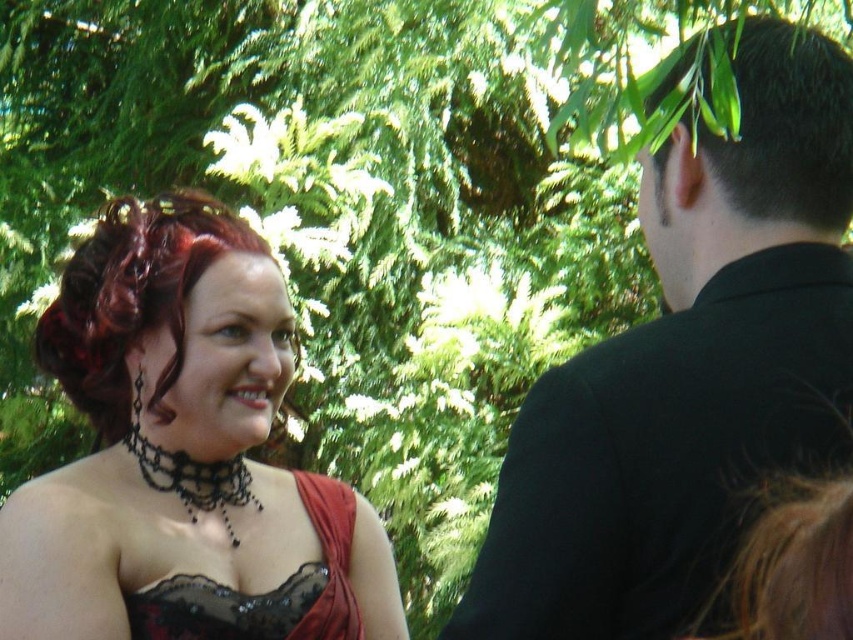
You are a photographer trying to capture a portrait of the two people in the scene. You want to ensure that both the black matte suit at upper right and the dark brown hair at upper right are clearly visible in the frame. Based on their positions, which one should you focus on first to ensure proper alignment?

The black matte suit at upper right is to the left of dark brown hair at upper right. Therefore, you should focus on the black matte suit at upper right first to ensure proper alignment since it is positioned to the left of the dark brown hair at upper right.

You are a photographer setting up a shot in a park. You have two subjects in the frame, the black matte suit at upper right and the dark brown hair at upper right. Which subject should you focus on if you want to capture the larger one?

The black matte suit at upper right is larger in size than the dark brown hair at upper right, so you should focus on the black matte suit at upper right.